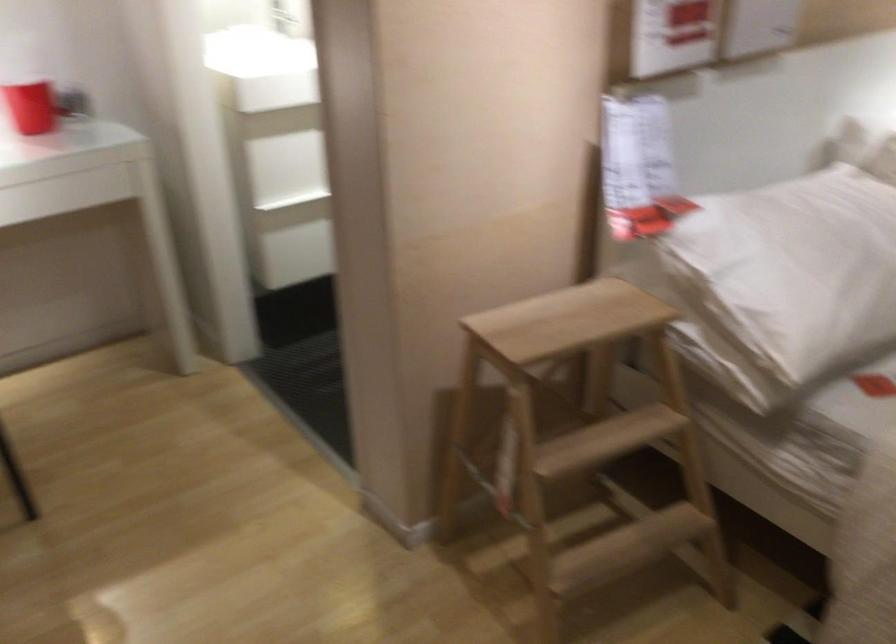
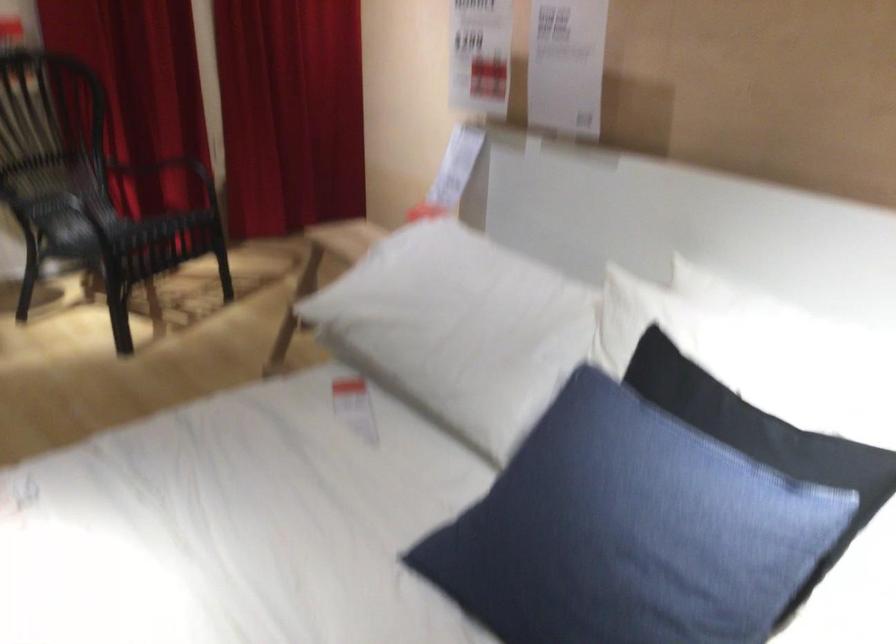
Question: I am providing you with two images of the same scene from different viewpoints. Which of the following objects are not visible in image2?

Choices:
 (A) white pillow
 (B) chair armrest
 (C) wooden step stool
 (D) white closed umbrella

Answer: (C)